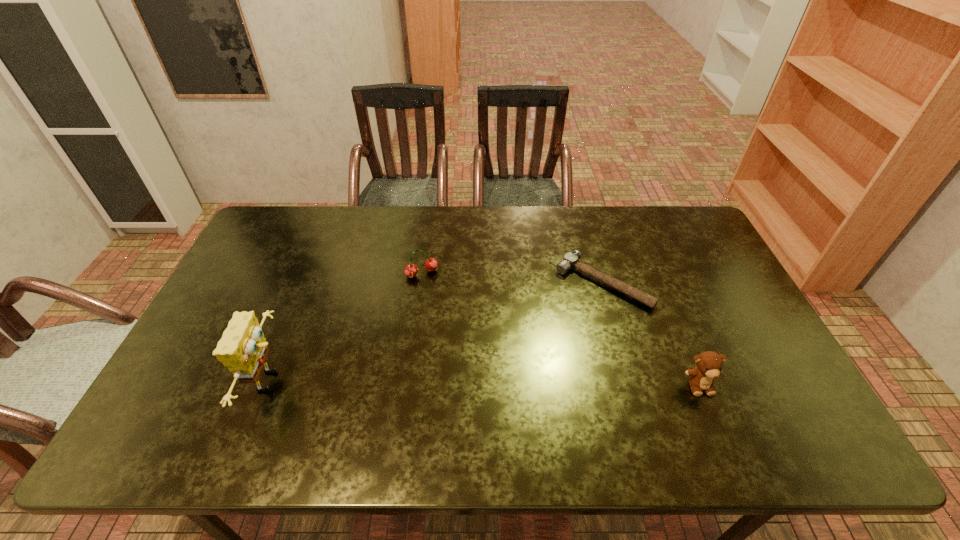
I want to click on vacant space on the desktop that is between the sponge and the teddy bear and is positioned with stems pointing upwards on the second object from left to right, so click(476, 383).

This screenshot has height=540, width=960. What are the coordinates of `vacant space on the desktop that is between the sponge and the teddy bear and is positioned on the striking face of the hammer` in the screenshot? It's located at (510, 383).